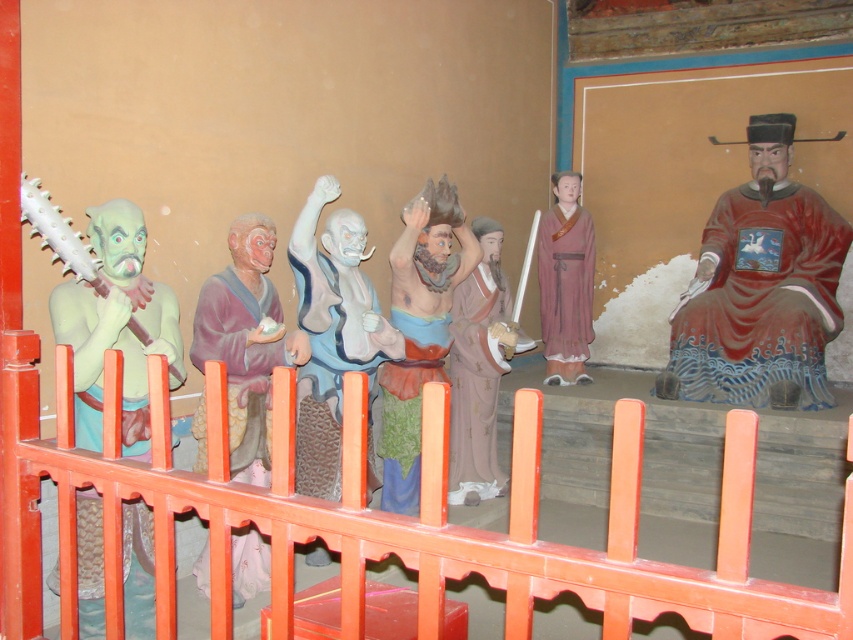
You are an art conservator tasked with measuring the statues and railings in the image. Given that the matte clay figure at center is 30 cm tall, can the orange painted wood rail at center fit entirely within a 40 cm tall storage box?

The orange painted wood rail at center is bigger than the matte clay figure at center, which is 30 cm tall. Therefore, the orange painted wood rail at center is taller than 30 cm and may not fit entirely within a 40 cm tall storage box without adjustments.

You are standing in front of the statues and want to touch the green painted wood figure at left. Is the orange painted wood rail at center blocking your path to the figure?

The orange painted wood rail at center is closer to the viewer than the green painted wood figure at left, so yes, the rail is blocking your path to the figure.